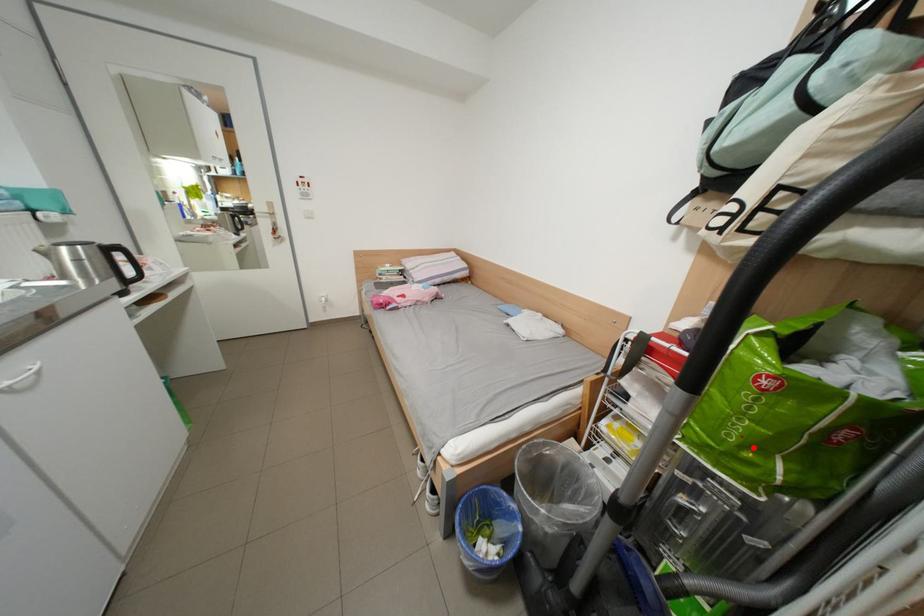
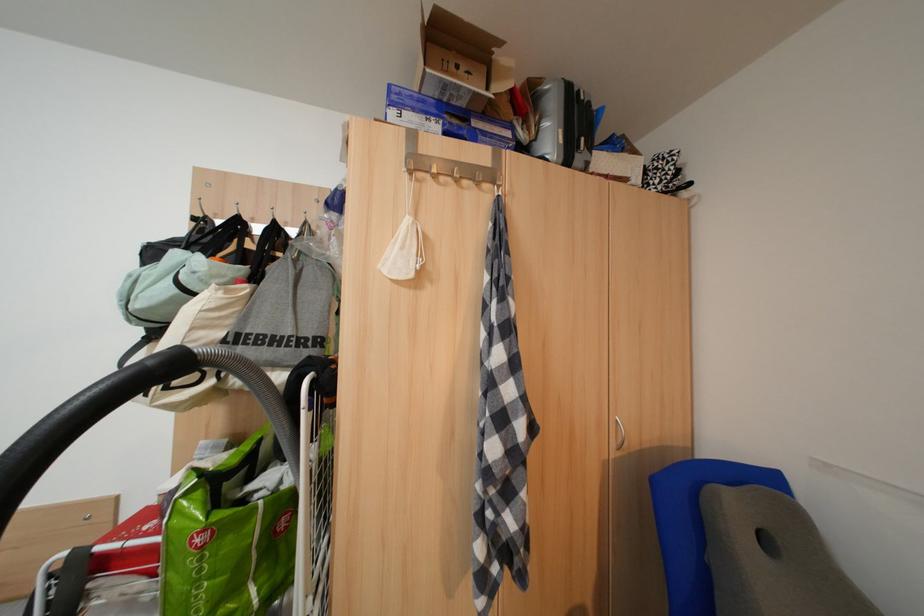
Question: I am providing you with two images of the same scene from different viewpoints. Image1 has a red point marked. In image2, the corresponding 3D location appears at what relative position? Reply with the corresponding letter.

Choices:
 (A) Closer
 (B) Farther

Answer: (A)